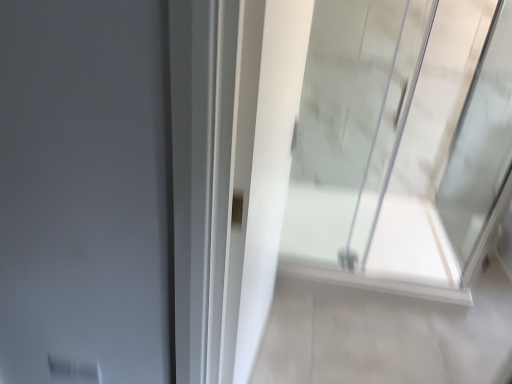
Question: Is transparent glass shower door at right turned away from white glossy shower door at center?

Choices:
 (A) no
 (B) yes

Answer: (A)

Question: Does transparent glass shower door at right have a larger size compared to white glossy shower door at center?

Choices:
 (A) no
 (B) yes

Answer: (A)

Question: Does transparent glass shower door at right appear on the right side of white glossy shower door at center?

Choices:
 (A) no
 (B) yes

Answer: (A)

Question: Is transparent glass shower door at right smaller than white glossy shower door at center?

Choices:
 (A) yes
 (B) no

Answer: (A)

Question: Could white glossy shower door at center be considered to be inside transparent glass shower door at right?

Choices:
 (A) yes
 (B) no

Answer: (B)

Question: Does transparent glass shower door at right have a lesser height compared to white glossy shower door at center?

Choices:
 (A) no
 (B) yes

Answer: (A)

Question: Is white glossy shower door at center thinner than transparent glass shower door at right?

Choices:
 (A) no
 (B) yes

Answer: (A)

Question: From the image's perspective, is white glossy shower door at center beneath transparent glass shower door at right?

Choices:
 (A) yes
 (B) no

Answer: (A)

Question: Can you confirm if white glossy shower door at center is bigger than transparent glass shower door at right?

Choices:
 (A) yes
 (B) no

Answer: (A)

Question: Is white glossy shower door at center wider than transparent glass shower door at right?

Choices:
 (A) no
 (B) yes

Answer: (B)

Question: Is transparent glass shower door at right inside white glossy shower door at center?

Choices:
 (A) yes
 (B) no

Answer: (B)

Question: Is white glossy shower door at center facing towards transparent glass shower door at right?

Choices:
 (A) yes
 (B) no

Answer: (B)

Question: Do you think white glossy shower door at center is within transparent glass shower door at right, or outside of it?

Choices:
 (A) inside
 (B) outside

Answer: (B)